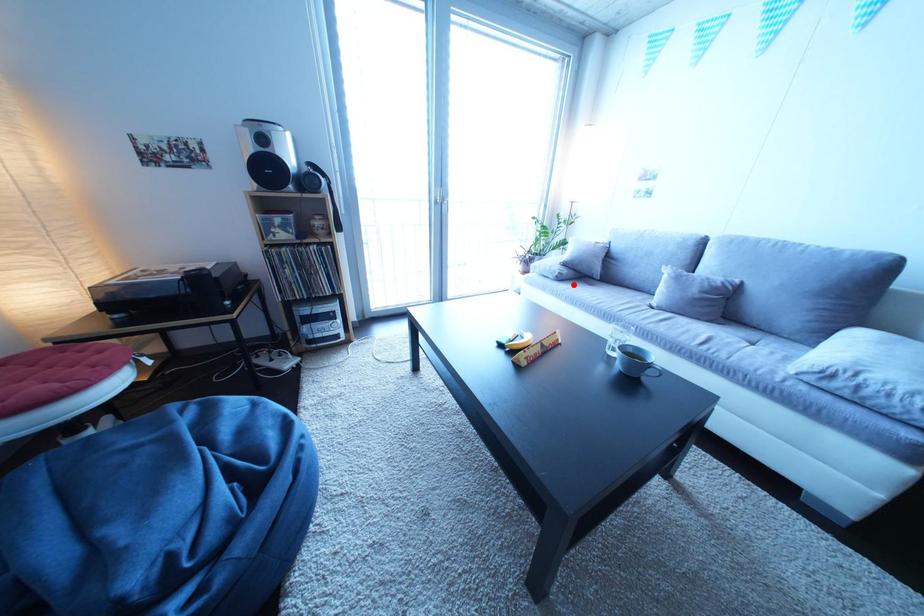
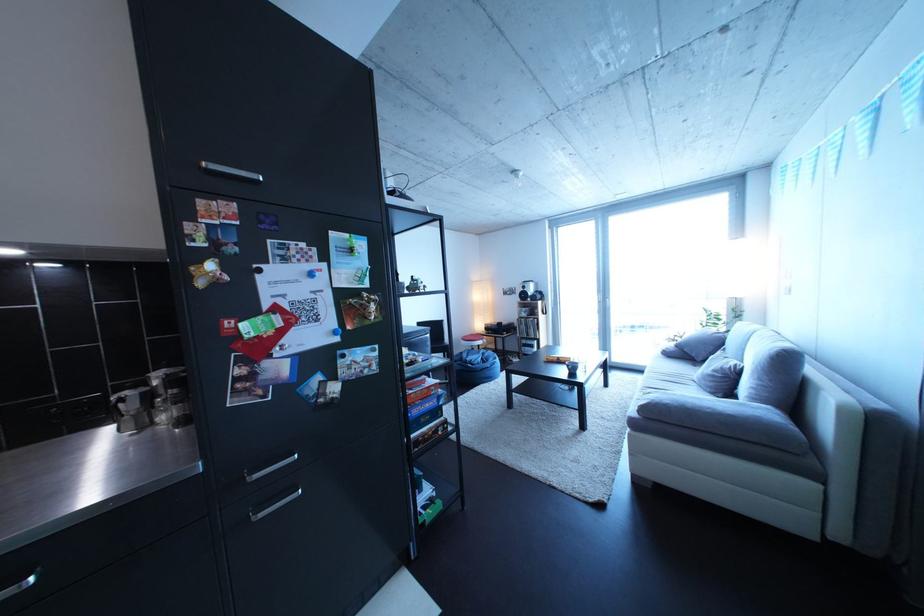
Question: I am providing you with two images of the same scene from different viewpoints. Image1 has a red point marked. In image2, the corresponding 3D location appears at what relative position? Reply with the corresponding letter.

Choices:
 (A) Closer
 (B) Farther

Answer: (B)